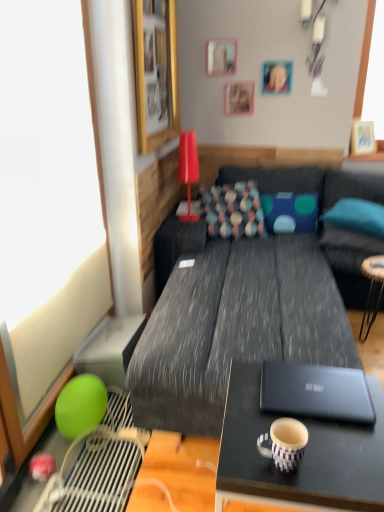
Question: Does point (276, 79) appear closer or farther from the camera than point (311, 387)?

Choices:
 (A) closer
 (B) farther

Answer: (B)

Question: From the image's perspective, is wooden picture frame at upper center, which appears as the second picture frame when viewed from the right, located above or below black matte laptop at center?

Choices:
 (A) below
 (B) above

Answer: (B)

Question: Which of these objects is positioned closest to the wooden picture frame at upper left, placed as the fifth picture frame when sorted from back to front?

Choices:
 (A) blue dotted pillow at right, marked as the 1th pillow in a right-to-left arrangement
 (B) black matte laptop at center
 (C) wooden picture frame at upper center, which is counted as the 3th picture frame, starting from the left
 (D) teal fabric bean bag chair at right
 (E) textured multicolored pillow at center, the first pillow in the left-to-right sequence

Answer: (C)

Question: Estimate the real-world distances between objects in this image. Which object is farther from the matte black laptop at lower right, which is counted as the second table, starting from the top?

Choices:
 (A) black matte table at right, which appears as the second table when viewed from the front
 (B) green matte balloon at left
 (C) matte red table lamp at upper center
 (D) teal fabric bean bag chair at right
 (E) blue dotted pillow at right, marked as the 1th pillow in a right-to-left arrangement

Answer: (C)